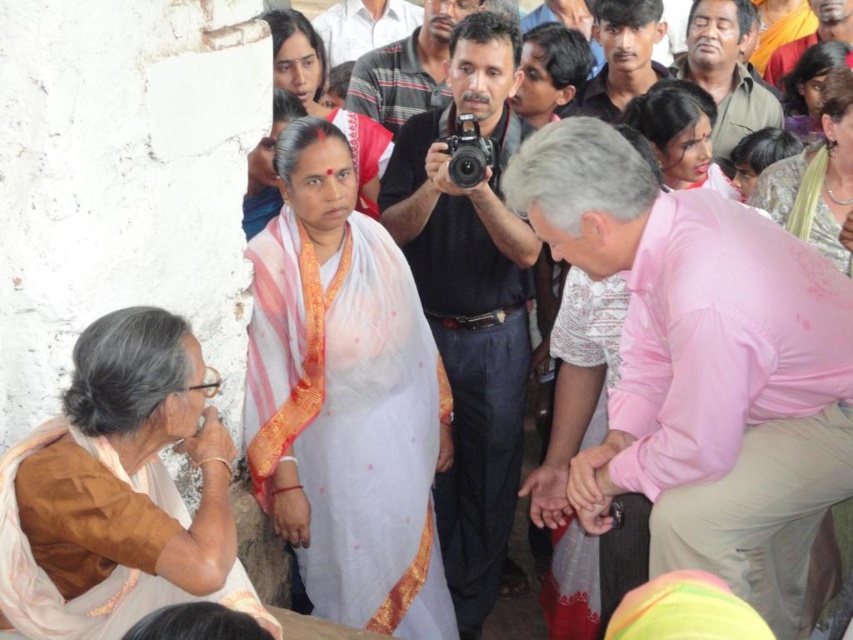
Can you confirm if white sheer saree at center is positioned to the left of matte pink saree at upper right?

Yes, white sheer saree at center is to the left of matte pink saree at upper right.

Locate an element on the screen. This screenshot has width=853, height=640. white sheer saree at center is located at coordinates [344, 400].

Can you confirm if matte white saree at center is bigger than dark brown hair at center?

Actually, matte white saree at center might be smaller than dark brown hair at center.

Does matte white saree at center appear over dark brown hair at center?

No.

You are a GUI agent. You are given a task and a screenshot of the screen. Output one action in this format:
    pyautogui.click(x=<x>, y=<y>)
    Task: Click on the matte white saree at center
    The image size is (853, 640).
    Given the screenshot: What is the action you would take?
    pyautogui.click(x=323, y=104)

Does brown silk saree at lower left have a lesser width compared to matte pink saree at upper right?

No.

Is brown silk saree at lower left smaller than matte pink saree at upper right?

Indeed, brown silk saree at lower left has a smaller size compared to matte pink saree at upper right.

This screenshot has height=640, width=853. I want to click on brown silk saree at lower left, so click(x=119, y=490).